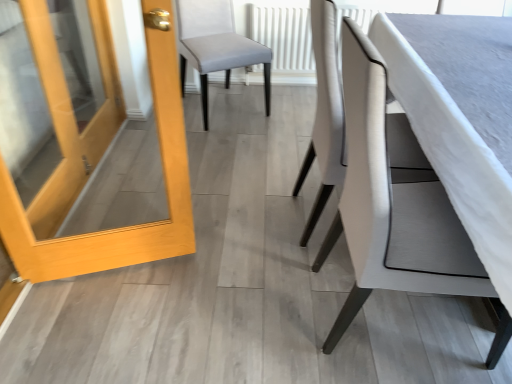
Question: Is white fabric chair at center, which is the first chair in front-to-back order, smaller than white fabric chair at center, which is counted as the 2th chair, starting from the back?

Choices:
 (A) no
 (B) yes

Answer: (A)

Question: From a real-world perspective, does white fabric chair at center, which is the first chair in front-to-back order, sit lower than white fabric chair at center, which is counted as the 2th chair, starting from the back?

Choices:
 (A) yes
 (B) no

Answer: (B)

Question: Could you tell me if white fabric chair at center, positioned as the 3th chair in back-to-front order, is facing white fabric chair at center, which is counted as the 2th chair, starting from the back?

Choices:
 (A) yes
 (B) no

Answer: (B)

Question: Is white fabric chair at center, positioned as the 3th chair in back-to-front order, in contact with white fabric chair at center, the second chair from the front?

Choices:
 (A) yes
 (B) no

Answer: (B)

Question: Is white fabric chair at center, positioned as the 3th chair in back-to-front order, thinner than white fabric chair at center, the second chair from the front?

Choices:
 (A) yes
 (B) no

Answer: (A)

Question: Considering the relative positions of light wood/matte door at left and white fabric chair at center, which is the first chair in front-to-back order, in the image provided, is light wood/matte door at left to the left or to the right of white fabric chair at center, which is the first chair in front-to-back order,?

Choices:
 (A) right
 (B) left

Answer: (B)

Question: Is light wood/matte door at left situated inside white fabric chair at center, which is the first chair in front-to-back order, or outside?

Choices:
 (A) inside
 (B) outside

Answer: (B)

Question: From the image's perspective, is light wood/matte door at left positioned above or below white fabric chair at center, positioned as the 3th chair in back-to-front order?

Choices:
 (A) below
 (B) above

Answer: (B)

Question: Considering the positions of light wood/matte door at left and white fabric chair at center, positioned as the 3th chair in back-to-front order, in the image, is light wood/matte door at left bigger or smaller than white fabric chair at center, positioned as the 3th chair in back-to-front order,?

Choices:
 (A) small
 (B) big

Answer: (A)

Question: Considering the relative positions of light gray fabric chair at center, the 3th chair from the front, and white textured radiator at center in the image provided, is light gray fabric chair at center, the 3th chair from the front, to the left or to the right of white textured radiator at center?

Choices:
 (A) right
 (B) left

Answer: (B)

Question: Considering their positions, is light gray fabric chair at center, which ranks as the first chair in back-to-front order, located in front of or behind white textured radiator at center?

Choices:
 (A) front
 (B) behind

Answer: (A)

Question: From the image's perspective, is light gray fabric chair at center, the 3th chair from the front, located above or below white textured radiator at center?

Choices:
 (A) below
 (B) above

Answer: (A)

Question: From a real-world perspective, is light gray fabric chair at center, the 3th chair from the front, above or below white textured radiator at center?

Choices:
 (A) above
 (B) below

Answer: (A)

Question: Considering the positions of point pos(322,122) and point pos(293,74), is point pos(322,122) closer or farther from the camera than point pos(293,74)?

Choices:
 (A) closer
 (B) farther

Answer: (A)

Question: Choose the correct answer: Is white fabric chair at center, the second chair from the front, inside white textured radiator at center or outside it?

Choices:
 (A) outside
 (B) inside

Answer: (A)